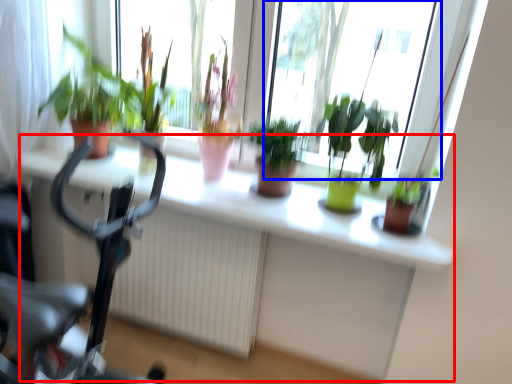
Question: Which point is closer to the camera, computer desk (highlighted by a red box) or bay window (highlighted by a blue box)?

Choices:
 (A) computer desk
 (B) bay window

Answer: (A)